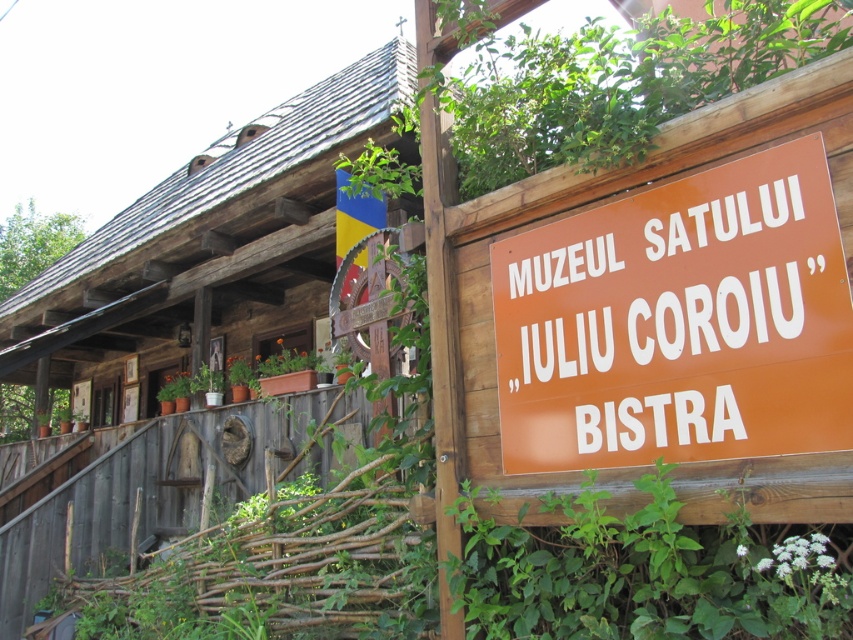
You are a tourist standing in front of the MUZEUL SATULUI museum and want to take a photo of both the brown wooden log cabin at upper left and the orange matte sign at center. Which object should you focus on first to ensure both are in the frame?

You should focus on the brown wooden log cabin at upper left first because it is larger than the orange matte sign at center, so it will require more space in the photo frame.

You are standing in front of the museum and want to take a photo of both the brown wooden log cabin at upper left and the orange matte sign at center. Which object should you position to the left side in your camera frame to include both in the shot?

The brown wooden log cabin at upper left is positioned on the left side of orange matte sign at center, so you should position the brown wooden log cabin at upper left to the left side in your camera frame to include both in the shot.

You are a tourist standing in front of the museum and want to read the orange matte sign at center. However, the brown wooden log cabin at upper left is blocking your view. Can you move around to see the sign clearly?

The orange matte sign at center is behind the brown wooden log cabin at upper left, so you can move to the side of the cabin to get a clear view of the sign.